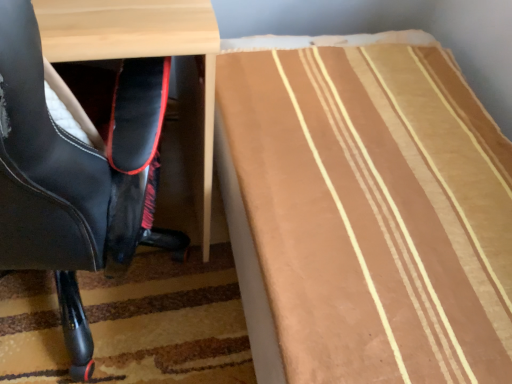
Question: Can you confirm if brown striped fabric at lower right is wider than black leather chair at left?

Choices:
 (A) yes
 (B) no

Answer: (A)

Question: Would you say brown striped fabric at lower right is a long distance from black leather chair at left?

Choices:
 (A) no
 (B) yes

Answer: (A)

Question: From a real-world perspective, is brown striped fabric at lower right located higher than black leather chair at left?

Choices:
 (A) yes
 (B) no

Answer: (B)

Question: Is brown striped fabric at lower right outside black leather chair at left?

Choices:
 (A) no
 (B) yes

Answer: (B)

Question: Considering the relative sizes of brown striped fabric at lower right and black leather chair at left in the image provided, is brown striped fabric at lower right bigger than black leather chair at left?

Choices:
 (A) no
 (B) yes

Answer: (B)

Question: Does brown striped fabric at lower right come in front of black leather chair at left?

Choices:
 (A) no
 (B) yes

Answer: (A)

Question: Are black leather chair at left and brown striped fabric at lower right located far from each other?

Choices:
 (A) no
 (B) yes

Answer: (A)

Question: Is black leather chair at left not inside brown striped fabric at lower right?

Choices:
 (A) yes
 (B) no

Answer: (A)

Question: From a real-world perspective, is black leather chair at left on top of brown striped fabric at lower right?

Choices:
 (A) yes
 (B) no

Answer: (A)

Question: Is black leather chair at left looking in the opposite direction of brown striped fabric at lower right?

Choices:
 (A) yes
 (B) no

Answer: (B)

Question: Is black leather chair at left oriented towards brown striped fabric at lower right?

Choices:
 (A) yes
 (B) no

Answer: (B)

Question: From the image's perspective, would you say black leather chair at left is positioned over brown striped fabric at lower right?

Choices:
 (A) no
 (B) yes

Answer: (B)

Question: Considering the relative positions of brown striped fabric at lower right and black leather chair at left in the image provided, is brown striped fabric at lower right to the left or to the right of black leather chair at left?

Choices:
 (A) left
 (B) right

Answer: (B)